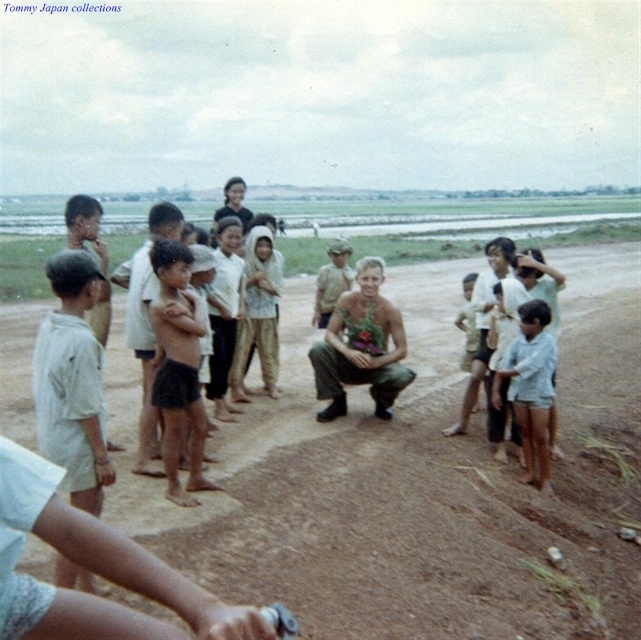
Question: Does dark brown shorts at center come in front of light brown fabric headscarf at center?

Choices:
 (A) yes
 (B) no

Answer: (A)

Question: Considering the real-world distances, which object is closest to the dark brown shorts at center?

Choices:
 (A) light blue cotton shirt at lower right
 (B) dark brown skin at center
 (C) light brown fabric headscarf at center
 (D) brown dirt field at center

Answer: (D)

Question: Which object appears farthest from the camera in this image?

Choices:
 (A) light brown fabric headscarf at center
 (B) white cotton shirt at left

Answer: (A)

Question: Which point is farther to the camera?

Choices:
 (A) pyautogui.click(x=537, y=374)
 (B) pyautogui.click(x=37, y=378)
 (C) pyautogui.click(x=269, y=298)

Answer: (C)

Question: Is camouflage fabric man at center to the left of light brown fabric headscarf at center from the viewer's perspective?

Choices:
 (A) no
 (B) yes

Answer: (A)

Question: From the image, what is the correct spatial relationship of dark brown shorts at center in relation to light brown fabric headscarf at center?

Choices:
 (A) left
 (B) right

Answer: (A)